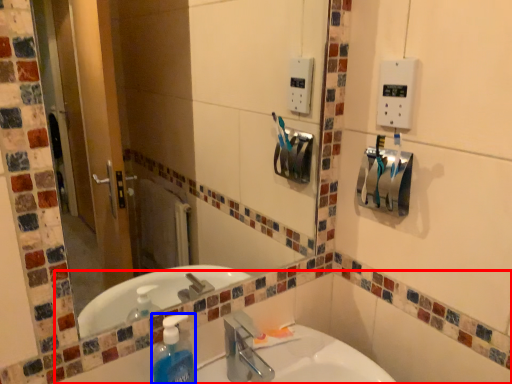
Question: Which object appears farthest to the camera in this image, bath (highlighted by a red box) or cleaning product (highlighted by a blue box)?

Choices:
 (A) bath
 (B) cleaning product

Answer: (B)